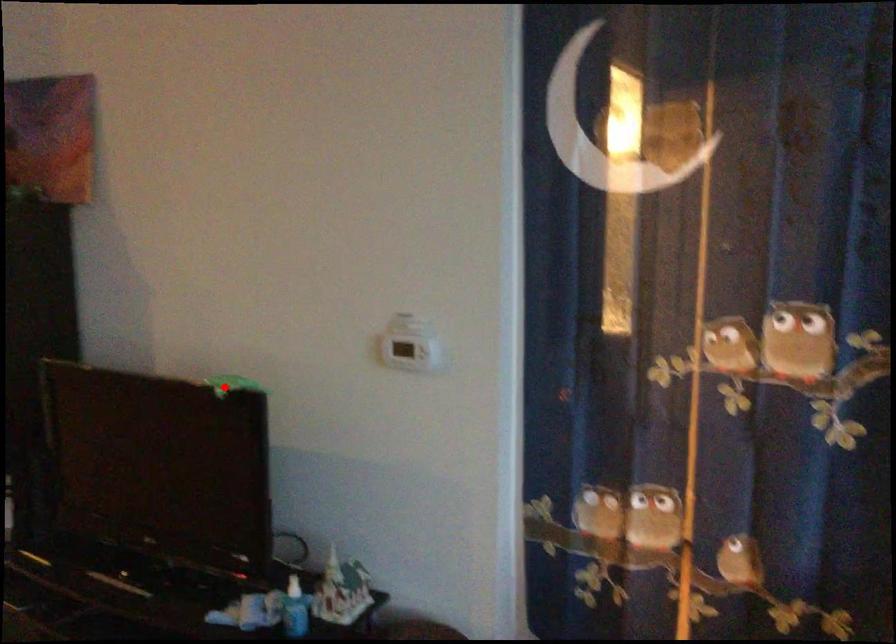
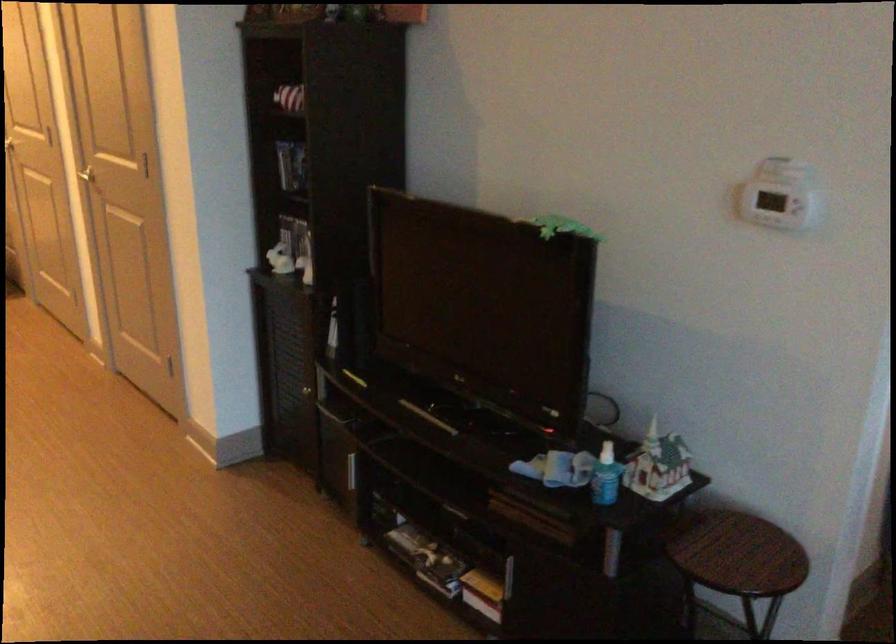
Question: I am providing you with two images of the same scene from different viewpoints. Image1 has a red point marked. In image2, the corresponding 3D location appears at what relative position? Reply with the corresponding letter.

Choices:
 (A) Closer
 (B) Farther

Answer: (A)